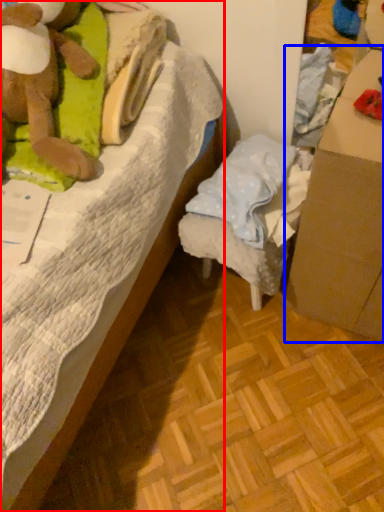
Question: Which point is further to the camera, bed (highlighted by a red box) or cardboard box (highlighted by a blue box)?

Choices:
 (A) bed
 (B) cardboard box

Answer: (B)